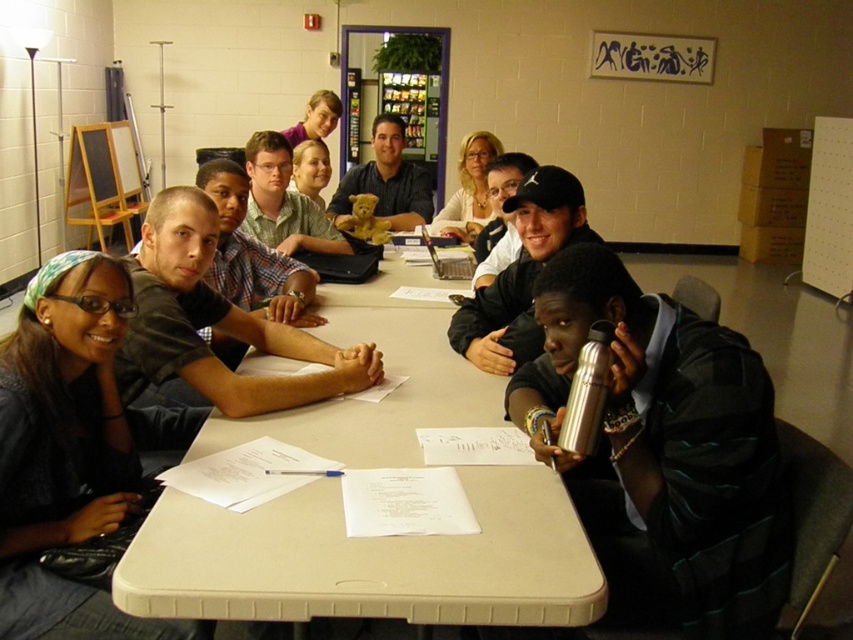
Question: Which of the following is the farthest from the observer?

Choices:
 (A) (90, 310)
 (B) (297, 131)
 (C) (778, 532)
 (D) (79, 148)

Answer: (D)

Question: Which object is closer to the camera taking this photo?

Choices:
 (A) smooth beige teddy bear at center
 (B) green plaid shirt at center
 (C) matte brown teddy bear at upper center
 (D) beige plastic table at center

Answer: (D)

Question: Is beige plastic table at center thinner than matte brown teddy bear at upper center?

Choices:
 (A) no
 (B) yes

Answer: (A)

Question: Is black fabric shirt at lower left wider than smooth beige teddy bear at center?

Choices:
 (A) no
 (B) yes

Answer: (B)

Question: Which of the following is the closest to the observer?

Choices:
 (A) (619, 403)
 (B) (550, 580)

Answer: (B)

Question: Is silver metallic thermos at lower right to the right of black fabric shirt at lower left from the viewer's perspective?

Choices:
 (A) no
 (B) yes

Answer: (B)